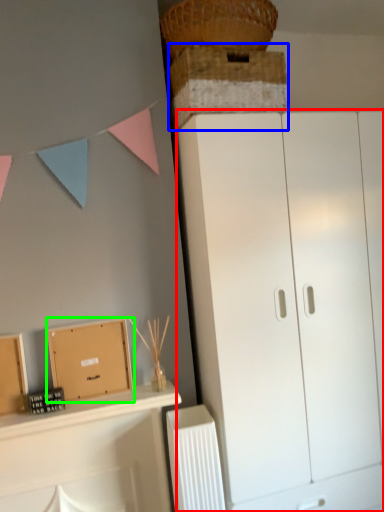
Question: Which object is positioned farthest from cupboard (highlighted by a red box)? Select from cabinetry (highlighted by a blue box) and cardboard box (highlighted by a green box).

Choices:
 (A) cabinetry
 (B) cardboard box

Answer: (B)